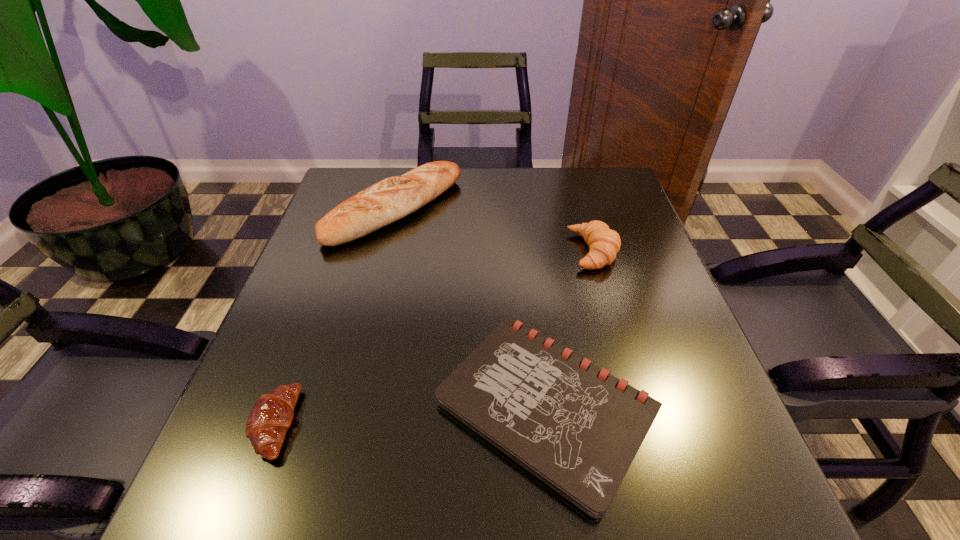
Where is `free space between the taller crescent roll and the shortest object`? free space between the taller crescent roll and the shortest object is located at coordinates (570, 329).

The width and height of the screenshot is (960, 540). In order to click on free space between the notebook and the third tallest object in this screenshot , I will do `click(410, 415)`.

Find the location of a particular element. This screenshot has width=960, height=540. vacant space that is in between the shortest object and the shorter crescent roll is located at coordinates (410, 415).

I want to click on free spot between the shorter crescent roll and the baguet, so click(x=335, y=317).

Image resolution: width=960 pixels, height=540 pixels. I want to click on the third closest object to the nearer crescent roll, so click(x=604, y=243).

Locate an element on the screen. Image resolution: width=960 pixels, height=540 pixels. object that is the second closest to the baguet is located at coordinates (604, 243).

Identify the location of free space that satisfies the following two spatial constraints: 1. on the back side of the notebook; 2. on the right side of the taller crescent roll. The height and width of the screenshot is (540, 960). (527, 252).

Find the location of a particular element. vacant space that satisfies the following two spatial constraints: 1. on the back side of the taller crescent roll; 2. on the left side of the shorter crescent roll is located at coordinates (338, 252).